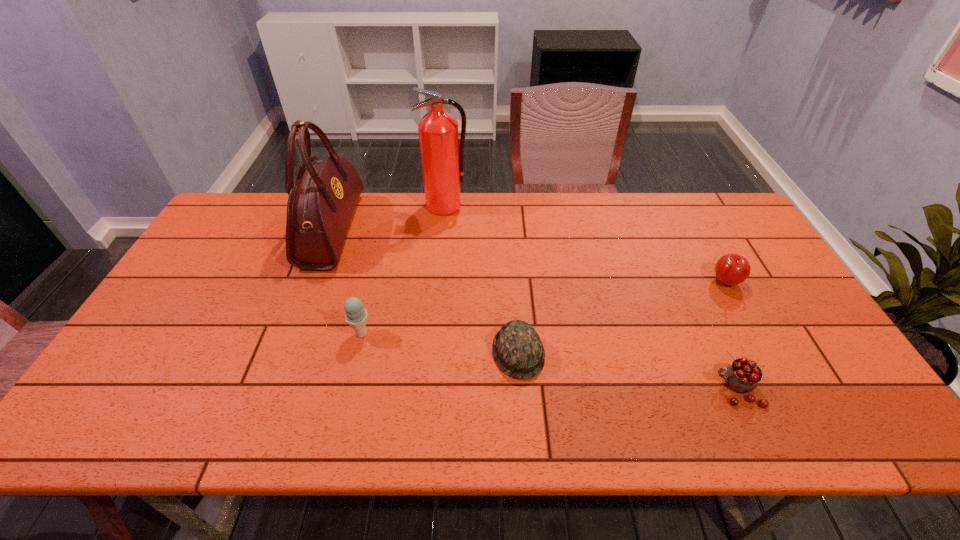
I want to click on object present at the right edge, so click(x=731, y=269).

Identify the location of free space at the far edge. This screenshot has height=540, width=960. (639, 230).

The image size is (960, 540). In the image, there is a desktop. Identify the location of free space at the near edge. (357, 413).

In the image, there is a desktop. Where is `vacant space at the left edge`? The height and width of the screenshot is (540, 960). vacant space at the left edge is located at coordinates (158, 357).

In the image, there is a desktop. Where is `vacant area at the right edge`? Image resolution: width=960 pixels, height=540 pixels. vacant area at the right edge is located at coordinates (862, 396).

Find the location of a particular element. vacant region at the far left corner of the desktop is located at coordinates (265, 201).

The width and height of the screenshot is (960, 540). I want to click on vacant point at the far right corner, so click(x=704, y=204).

You are a GUI agent. You are given a task and a screenshot of the screen. Output one action in this format:
    pyautogui.click(x=<x>, y=<y>)
    Task: Click on the vacant space in between the headwear and the third object from left to right
    
    Given the screenshot: What is the action you would take?
    pyautogui.click(x=482, y=279)

This screenshot has width=960, height=540. What are the coordinates of `free area in between the fifth object from right to left and the fourth object from right to left` in the screenshot? It's located at (403, 269).

This screenshot has width=960, height=540. Identify the location of free area in between the ice cream and the fourth object from right to left. (403, 269).